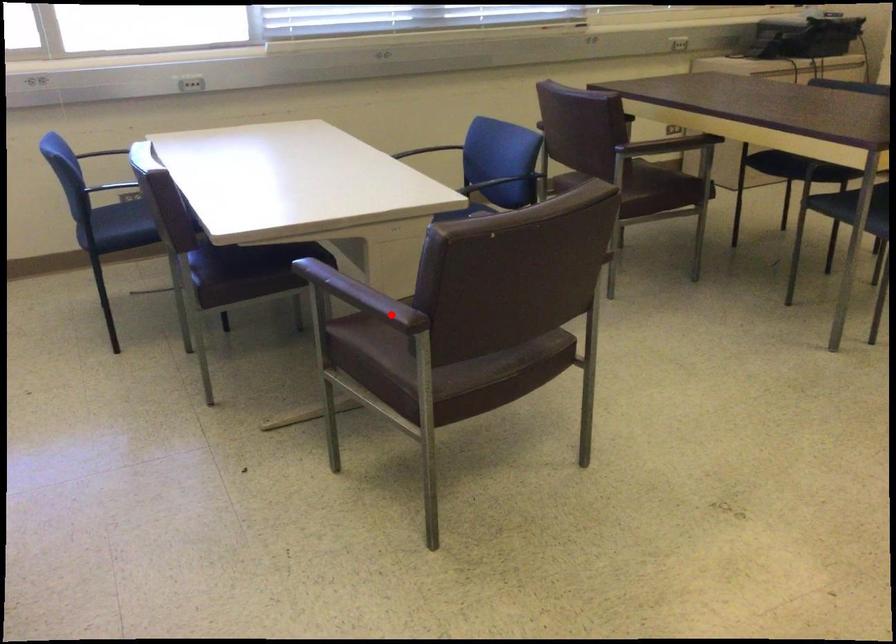
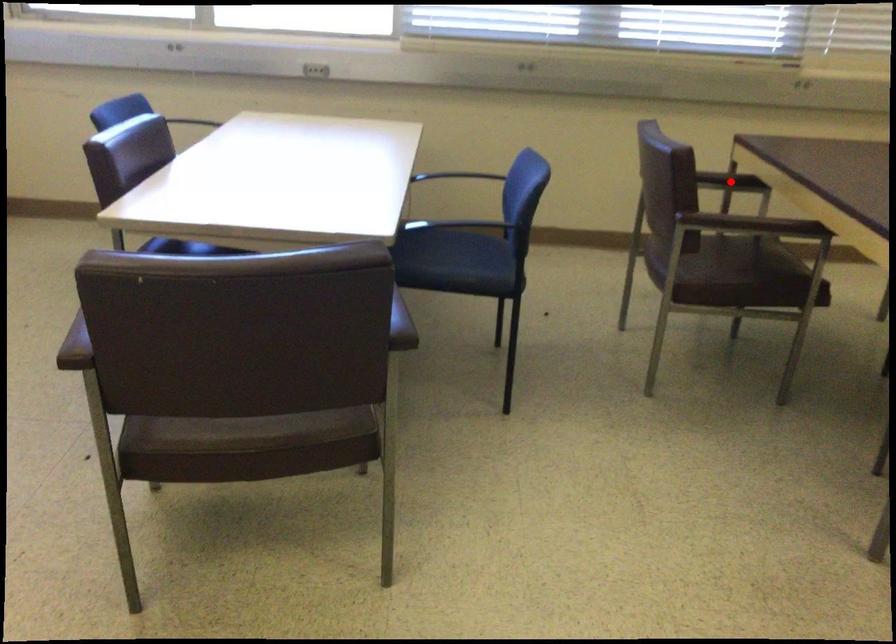
I am providing you with two images of the same scene from different viewpoints. A red point is marked on the first image and another point is marked on the second image. Does the point marked in image1 correspond to the same location as the one in image2?

No